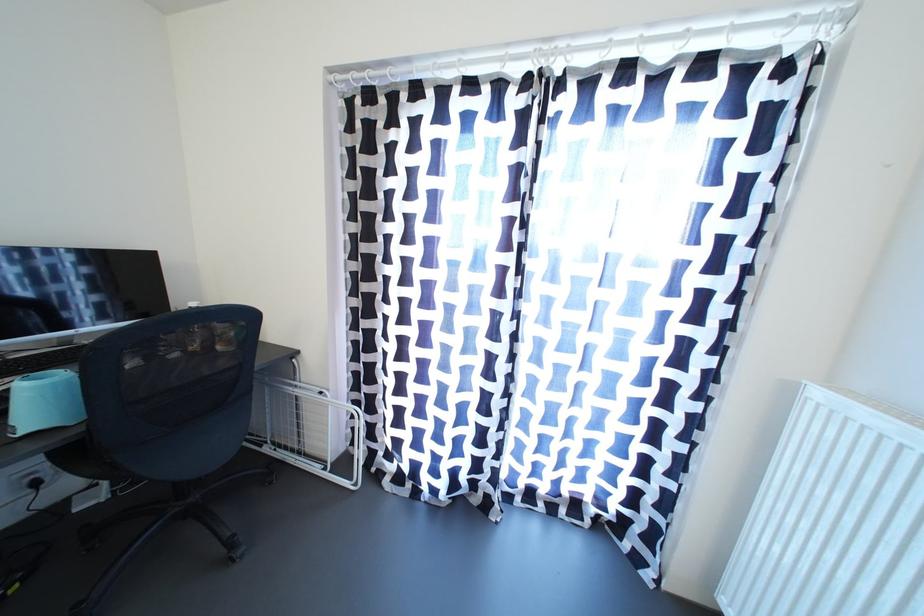
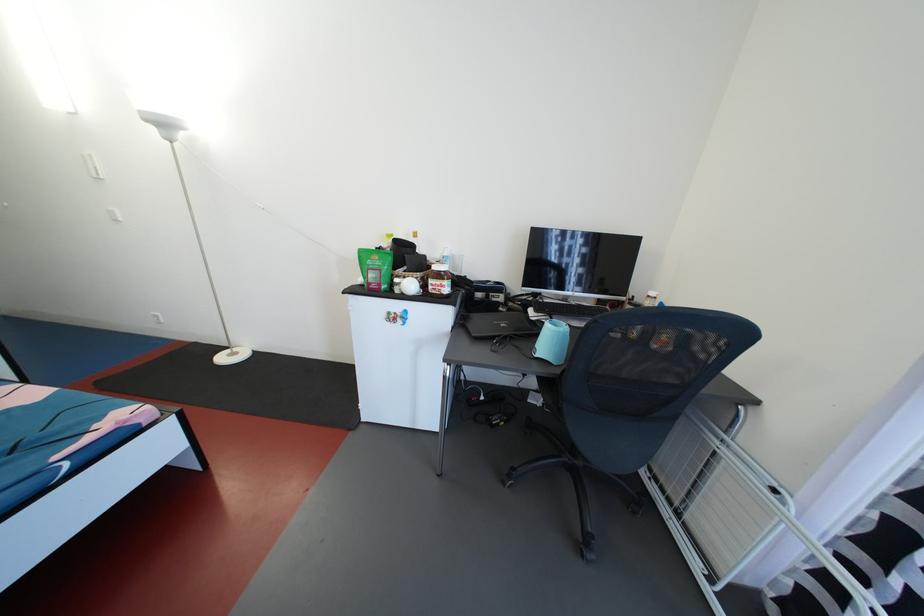
Question: The camera is either moving clockwise (left) or counter-clockwise (right) around the object. The first image is from the beginning of the video and the second image is from the end. Is the camera moving left or right when shooting the video?

Choices:
 (A) Left
 (B) Right

Answer: (B)